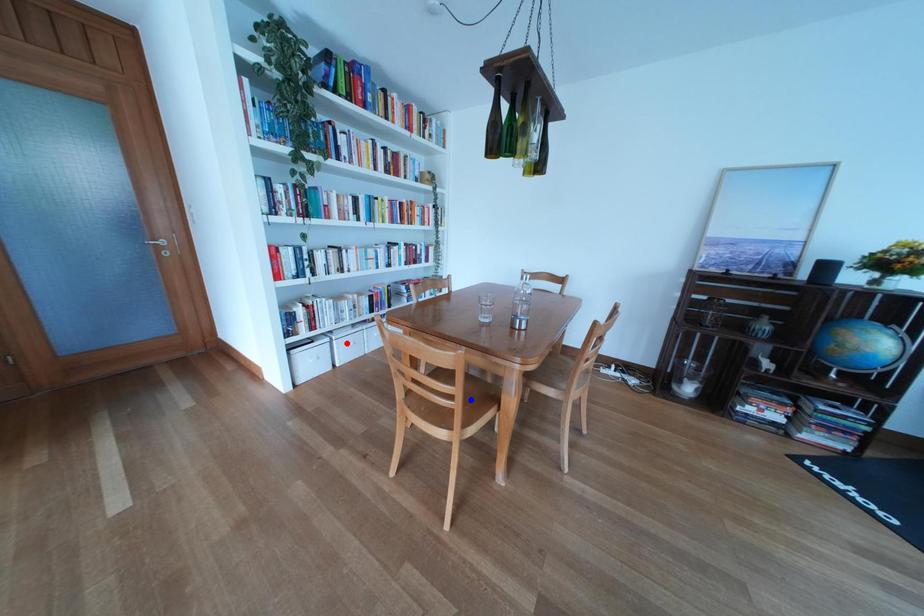
Question: Which of the two points in the image is closer to the camera?

Choices:
 (A) Blue point is closer.
 (B) Red point is closer.

Answer: (A)